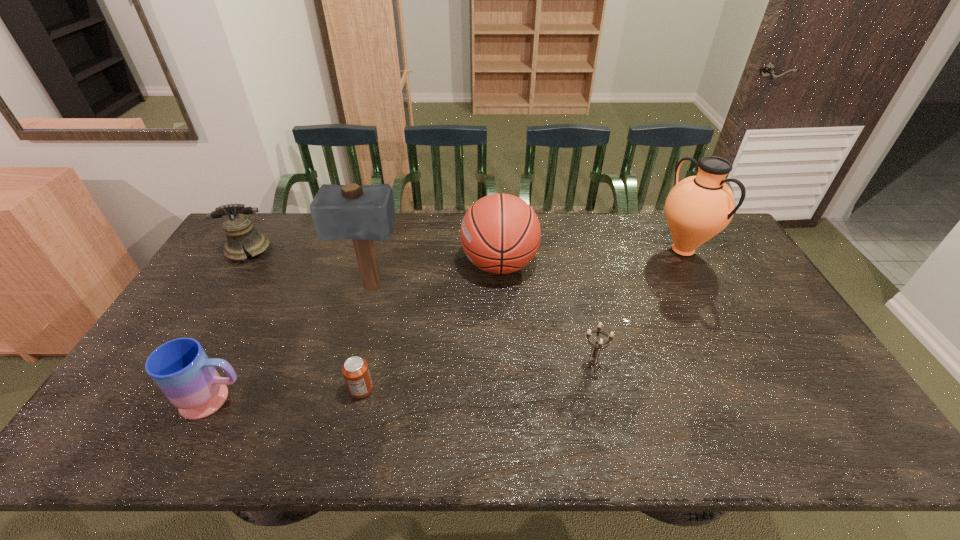
Locate an element on the screen. The height and width of the screenshot is (540, 960). bell at the far edge is located at coordinates (238, 228).

In order to click on object present at the near edge in this screenshot , I will do `click(182, 370)`.

The width and height of the screenshot is (960, 540). Identify the location of bell situated at the left edge. (238, 228).

Identify the location of mug at the left edge. This screenshot has width=960, height=540. (182, 370).

Find the location of `object at the right edge`. object at the right edge is located at coordinates (697, 208).

Locate an element on the screen. The width and height of the screenshot is (960, 540). object that is positioned at the far left corner is located at coordinates (238, 228).

Where is `object present at the near left corner`? This screenshot has height=540, width=960. object present at the near left corner is located at coordinates (182, 370).

The image size is (960, 540). I want to click on object that is positioned at the far right corner, so click(x=697, y=208).

This screenshot has width=960, height=540. In the image, there is a desktop. Find the location of `free region at the far edge`. free region at the far edge is located at coordinates (543, 213).

Where is `free space at the near edge of the desktop`? The height and width of the screenshot is (540, 960). free space at the near edge of the desktop is located at coordinates (586, 430).